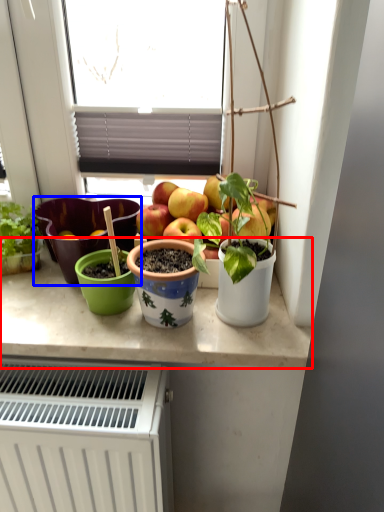
Question: Which object is further to the camera taking this photo, counter top (highlighted by a red box) or flowerpot (highlighted by a blue box)?

Choices:
 (A) counter top
 (B) flowerpot

Answer: (B)